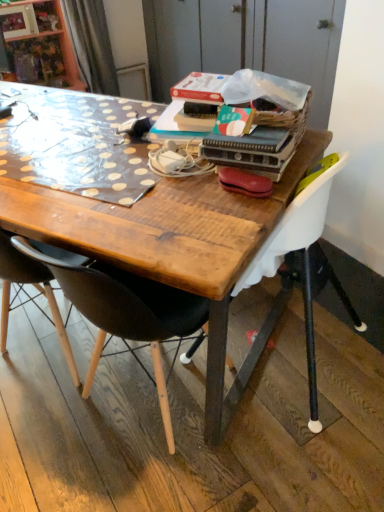
Where is `free point in front of white plastic chair at upper right, which is the 1th chair from right to left`? free point in front of white plastic chair at upper right, which is the 1th chair from right to left is located at coordinates (273, 452).